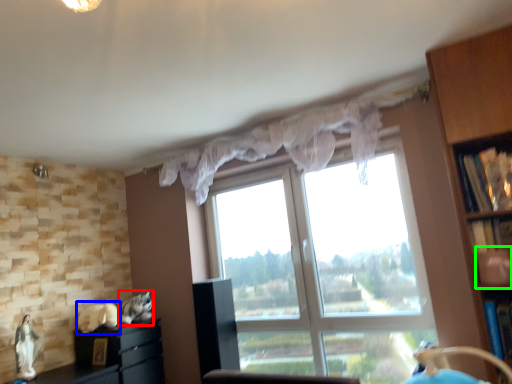
Question: Which is nearer to the animal (highlighted by a red box)? animal (highlighted by a blue box) or shelf (highlighted by a green box).

Choices:
 (A) animal
 (B) shelf

Answer: (A)